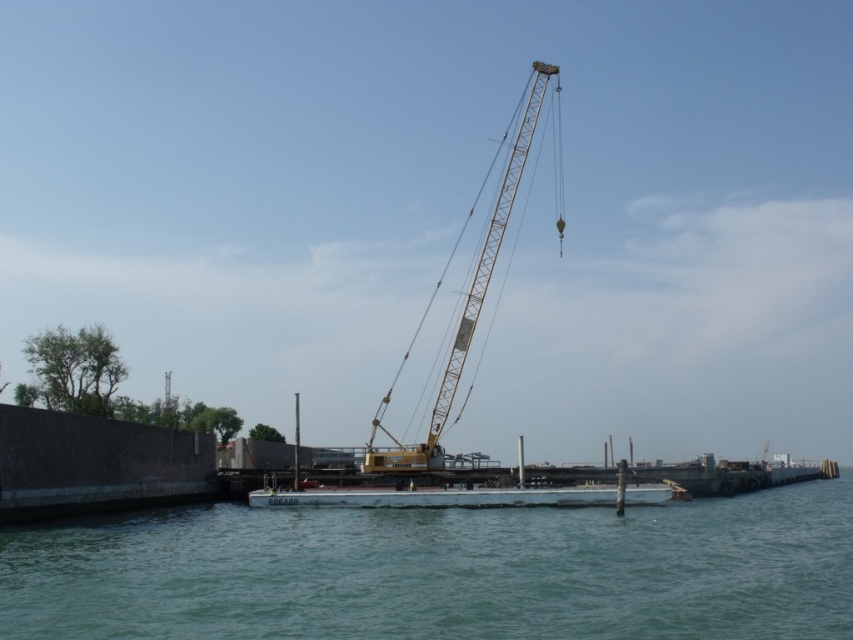
Can you confirm if greenish-blue water at center is bigger than yellow metallic crane at center?

Actually, greenish-blue water at center might be smaller than yellow metallic crane at center.

Is greenish-blue water at center to the left of yellow metallic crane at center from the viewer's perspective?

Indeed, greenish-blue water at center is positioned on the left side of yellow metallic crane at center.

Identify the location of greenish-blue water at center. tap(442, 572).

Where is `greenish-blue water at center`? This screenshot has width=853, height=640. greenish-blue water at center is located at coordinates (442, 572).

Is yellow metallic crane at center bigger than white matte boat at center?

Correct, yellow metallic crane at center is larger in size than white matte boat at center.

What do you see at coordinates (467, 296) in the screenshot? I see `yellow metallic crane at center` at bounding box center [467, 296].

This screenshot has width=853, height=640. Find the location of `yellow metallic crane at center`. yellow metallic crane at center is located at coordinates (467, 296).

Which is more to the left, greenish-blue water at center or white matte boat at center?

Positioned to the left is greenish-blue water at center.

Can you confirm if greenish-blue water at center is shorter than white matte boat at center?

In fact, greenish-blue water at center may be taller than white matte boat at center.

Image resolution: width=853 pixels, height=640 pixels. Describe the element at coordinates (442, 572) in the screenshot. I see `greenish-blue water at center` at that location.

The width and height of the screenshot is (853, 640). I want to click on greenish-blue water at center, so click(442, 572).